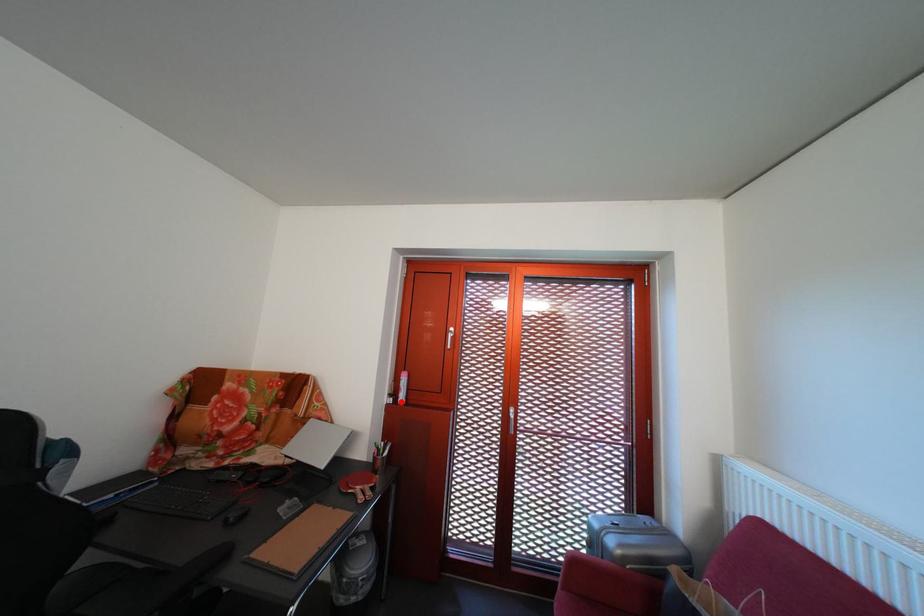
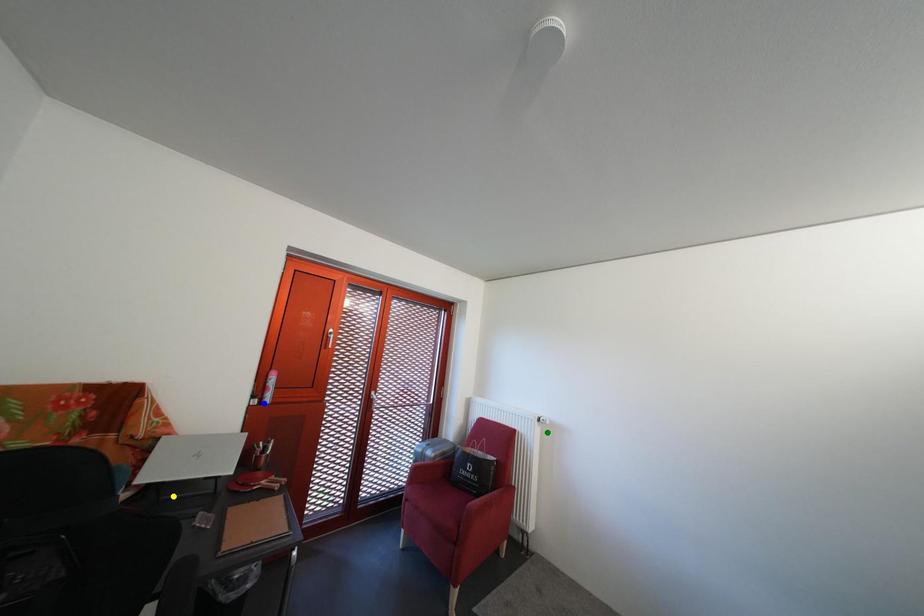
Question: I am providing you with two images of the same scene from different viewpoints. A red point is marked on the first image. You are given multiple points on the second image. Which point in image 2 is actually the same real-world point as the red point in image 1?

Choices:
 (A) yellow point
 (B) green point
 (C) blue point

Answer: (C)